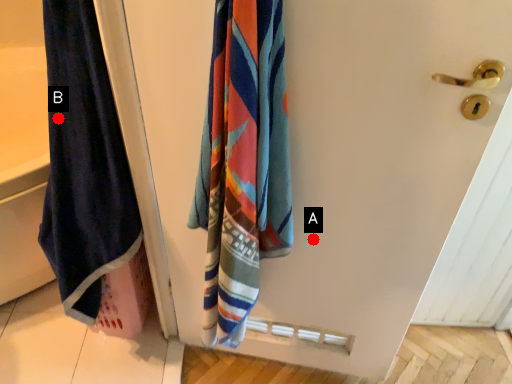
Question: Two points are circled on the image, labeled by A and B beside each circle. Which point is closer to the camera?

Choices:
 (A) A is closer
 (B) B is closer

Answer: (B)